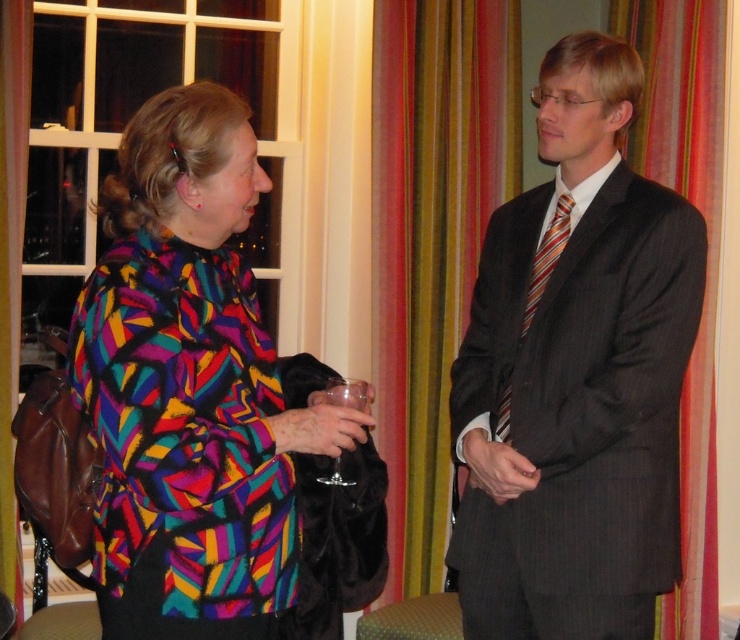
Question: Is striped silk tie at center positioned behind transparent glass at center?

Choices:
 (A) no
 (B) yes

Answer: (B)

Question: Based on their relative distances, which object is farther from the transparent glass at center?

Choices:
 (A) silky orange curtain at right
 (B) striped silk tie at center

Answer: (A)

Question: Does multicolored fabric coat at left have a greater width compared to silky orange curtain at right?

Choices:
 (A) no
 (B) yes

Answer: (B)

Question: Considering the real-world distances, which object is closest to the transparent glass at center?

Choices:
 (A) striped silk tie at center
 (B) multicolored fabric coat at left
 (C) silky orange curtain at right
 (D) striped fabric curtain at right

Answer: (B)

Question: Can you confirm if silky orange curtain at right is positioned below striped silk tie at center?

Choices:
 (A) yes
 (B) no

Answer: (B)

Question: Which is farther from the transparent glass at center?

Choices:
 (A) striped fabric curtain at right
 (B) silky orange curtain at right
 (C) multicolored fabric coat at left
 (D) striped silk tie at center

Answer: (B)